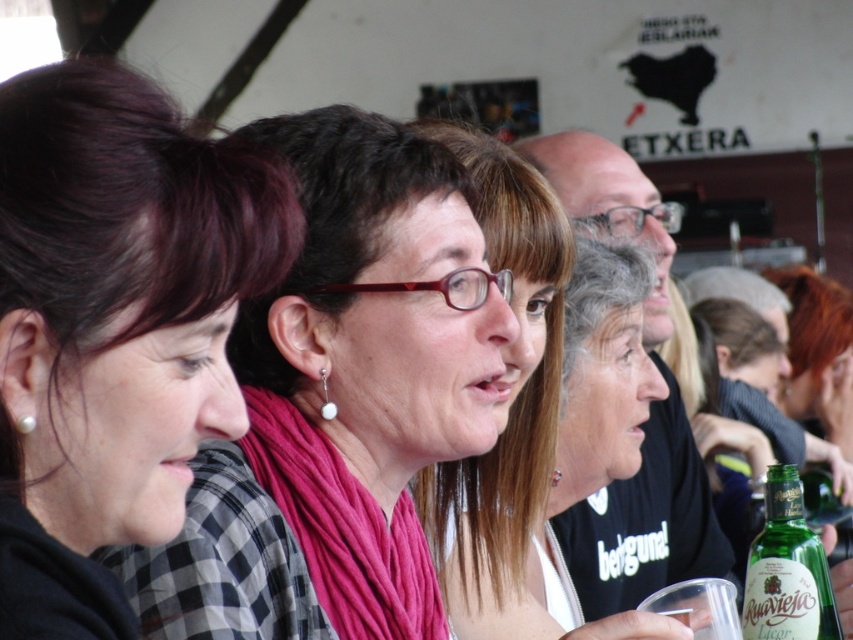
You are at a social gathering and want to grab a drink from the green glass bottle at lower right without disturbing the person with dark brown hair at left. Can you reach the bottle without moving the person?

The dark brown hair at left is to the left of the green glass bottle at lower right, so you can reach the bottle without disturbing the person since it is positioned to the right of their dark brown hair.

You are standing in the scene and want to hand a gift to the person wearing the pink fabric scarf at center. Which direction should you move to approach them?

The pink fabric scarf at center is located at point (339, 401), so you should move towards the center of the scene to reach them.